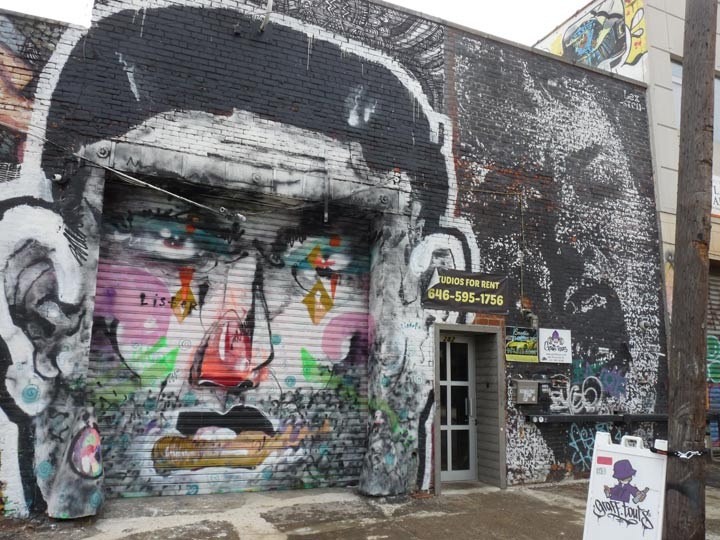
The image size is (720, 540). Identify the location of sliding door. (468, 292), (253, 319).